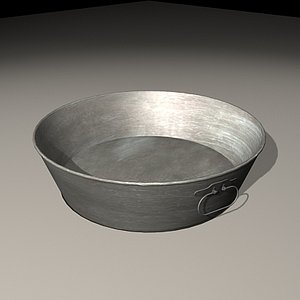
Locate an element on the screen. blank space, white table is located at coordinates (279, 197).